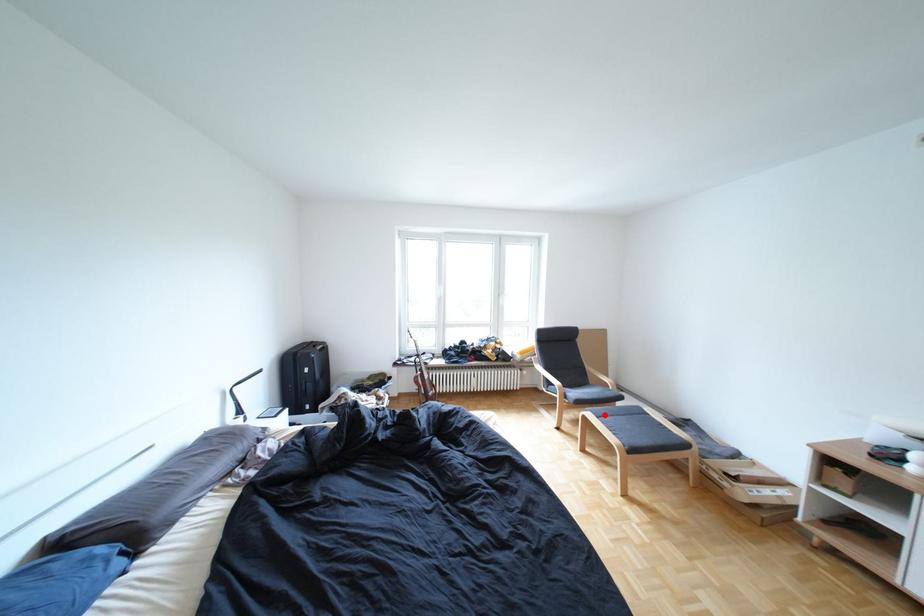
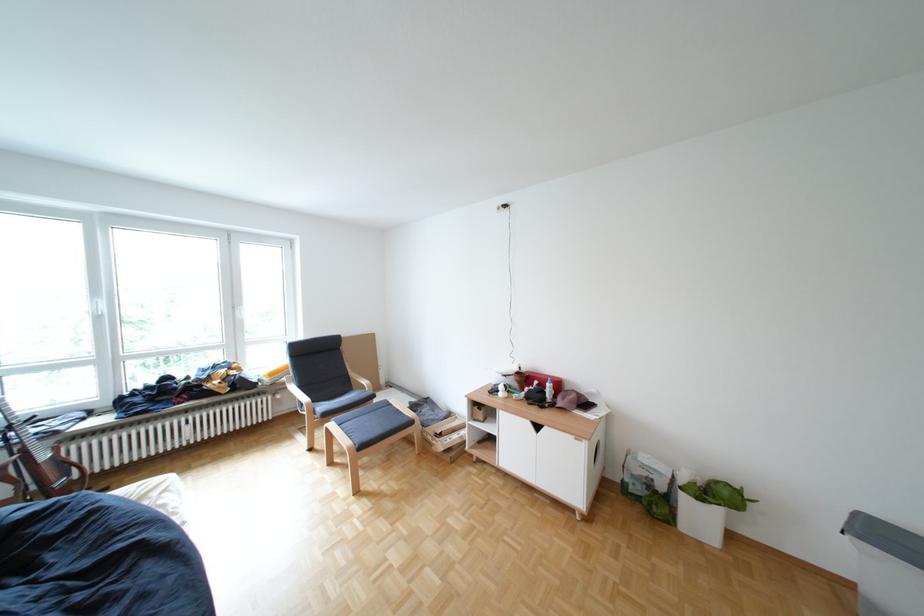
In the second image, find the point that corresponds to the highlighted location in the first image.

(346, 424)